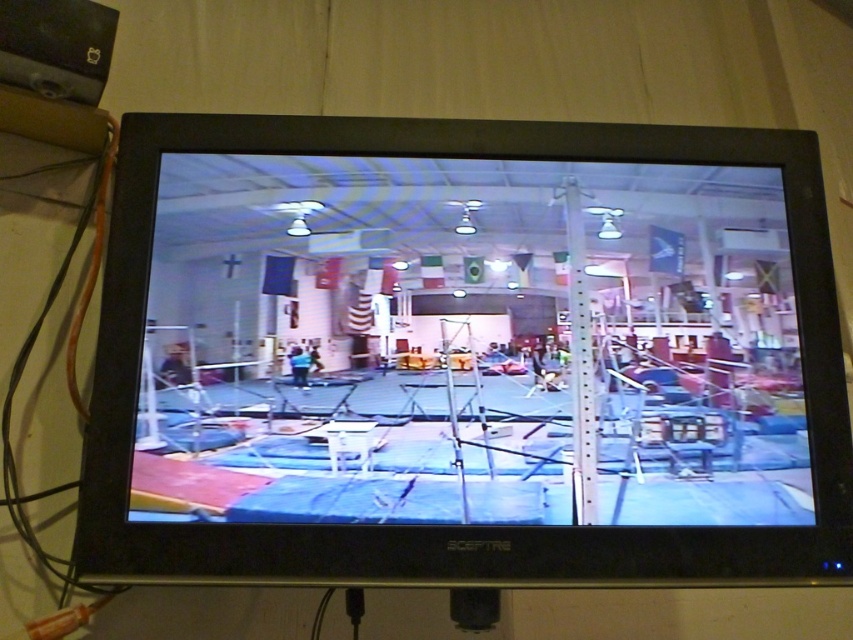
Question: Can you confirm if blue mat at center is thinner than orange cable at left?

Choices:
 (A) yes
 (B) no

Answer: (B)

Question: Does blue mat at center have a lesser width compared to orange cable at left?

Choices:
 (A) no
 (B) yes

Answer: (A)

Question: Which point appears closest to the camera in this image?

Choices:
 (A) (111, 116)
 (B) (606, 385)

Answer: (B)

Question: Which object appears farthest from the camera in this image?

Choices:
 (A) orange cable at left
 (B) blue mat at center

Answer: (B)

Question: Is blue mat at center to the right of orange cable at left from the viewer's perspective?

Choices:
 (A) no
 (B) yes

Answer: (B)